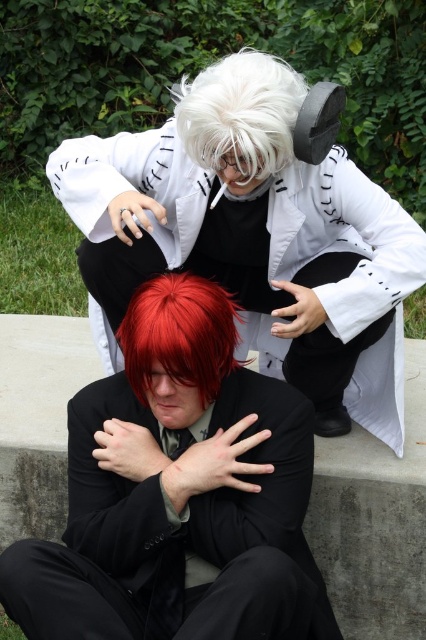
Can you confirm if shiny black suit at lower center is bigger than shiny red hair at center?

Yes, shiny black suit at lower center is bigger than shiny red hair at center.

Is shiny black suit at lower center further to camera compared to shiny red hair at center?

No, it is not.

You are a GUI agent. You are given a task and a screenshot of the screen. Output one action in this format:
    pyautogui.click(x=<x>, y=<y>)
    Task: Click on the shiny black suit at lower center
    Image resolution: width=426 pixels, height=640 pixels.
    Given the screenshot: What is the action you would take?
    pyautogui.click(x=180, y=493)

Identify the location of shiny black suit at lower center. (180, 493).

Which is more to the left, white matte coat at upper center or shiny black suit at lower center?

From the viewer's perspective, shiny black suit at lower center appears more on the left side.

Does white matte coat at upper center appear on the right side of shiny black suit at lower center?

Indeed, white matte coat at upper center is positioned on the right side of shiny black suit at lower center.

Which is behind, point (187, 193) or point (164, 531)?

The point (187, 193) is behind.

Identify the location of white matte coat at upper center. (253, 237).

Does white matte coat at upper center come in front of shiny red hair at center?

No, it is not.

Between white matte coat at upper center and shiny red hair at center, which one appears on the left side from the viewer's perspective?

shiny red hair at center is more to the left.

Measure the distance between white matte coat at upper center and camera.

A distance of 1.81 meters exists between white matte coat at upper center and camera.

Find the location of a particular element. white matte coat at upper center is located at coordinates (253, 237).